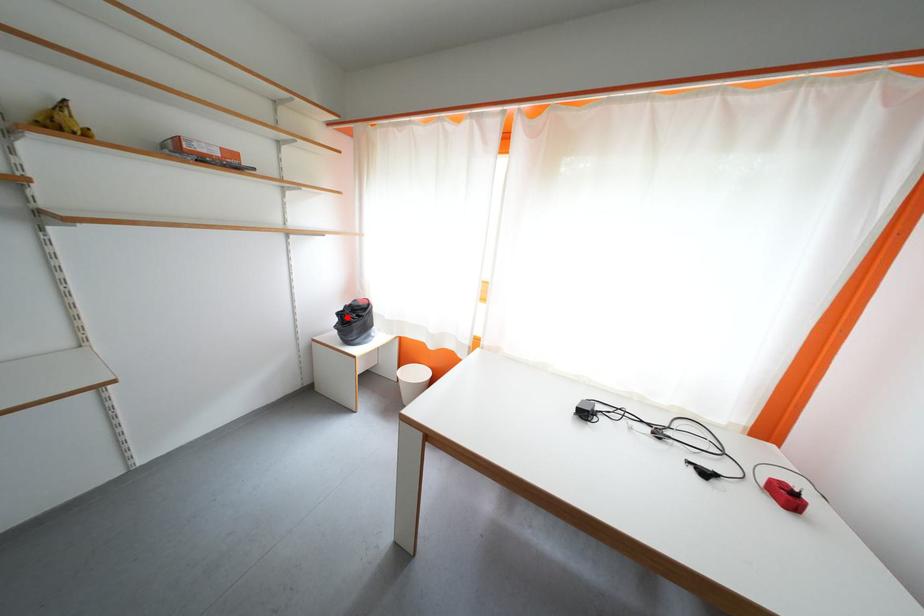
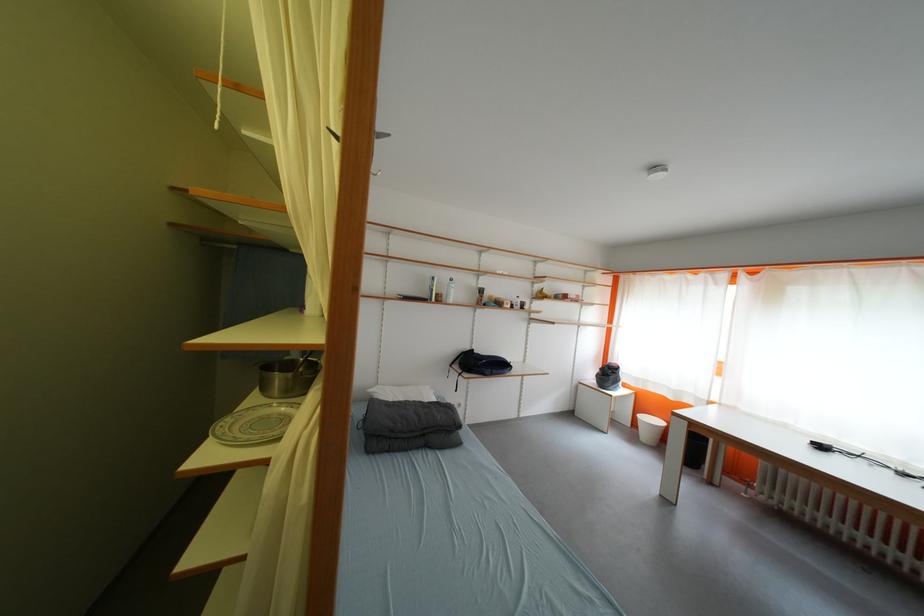
Question: A red point is marked in image1. In image2, is the corresponding 3D point closer to the camera or farther? Reply with the corresponding letter.

Choices:
 (A) The corresponding 3D point is closer.
 (B) The corresponding 3D point is farther.

Answer: (B)